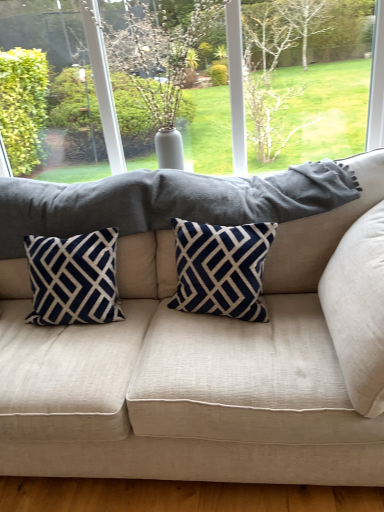
Question: Should I look upward or downward to see beige fabric pillow at right, arranged as the first pillow when viewed from the right?

Choices:
 (A) down
 (B) up

Answer: (A)

Question: Is navy velvet pillow at left, which ranks as the 3th pillow in right-to-left order, closer to camera compared to beige fabric pillow at right, arranged as the first pillow when viewed from the right?

Choices:
 (A) yes
 (B) no

Answer: (B)

Question: From a real-world perspective, is navy velvet pillow at left, arranged as the 1th pillow when viewed from the left, beneath beige fabric pillow at right, arranged as the first pillow when viewed from the right?

Choices:
 (A) yes
 (B) no

Answer: (A)

Question: Is navy velvet pillow at left, which ranks as the 3th pillow in right-to-left order, taller than beige fabric pillow at right, which ranks as the 3th pillow in left-to-right order?

Choices:
 (A) no
 (B) yes

Answer: (A)

Question: Is navy velvet pillow at left, arranged as the 1th pillow when viewed from the left, aimed at beige fabric pillow at right, arranged as the first pillow when viewed from the right?

Choices:
 (A) no
 (B) yes

Answer: (A)

Question: From the image's perspective, is navy velvet pillow at left, arranged as the 1th pillow when viewed from the left, above beige fabric pillow at right, arranged as the first pillow when viewed from the right?

Choices:
 (A) yes
 (B) no

Answer: (A)

Question: Considering the relative sizes of navy velvet pillow at left, which ranks as the 3th pillow in right-to-left order, and beige fabric pillow at right, which ranks as the 3th pillow in left-to-right order, in the image provided, is navy velvet pillow at left, which ranks as the 3th pillow in right-to-left order, thinner than beige fabric pillow at right, which ranks as the 3th pillow in left-to-right order,?

Choices:
 (A) no
 (B) yes

Answer: (B)

Question: Can you confirm if green leafy tree at upper center is bigger than beige fabric pillow at right, arranged as the first pillow when viewed from the right?

Choices:
 (A) yes
 (B) no

Answer: (B)

Question: Is green leafy tree at upper center at the right side of beige fabric pillow at right, which ranks as the 3th pillow in left-to-right order?

Choices:
 (A) no
 (B) yes

Answer: (A)

Question: Is green leafy tree at upper center touching beige fabric pillow at right, arranged as the first pillow when viewed from the right?

Choices:
 (A) no
 (B) yes

Answer: (A)

Question: From a real-world perspective, is green leafy tree at upper center located higher than beige fabric pillow at right, arranged as the first pillow when viewed from the right?

Choices:
 (A) no
 (B) yes

Answer: (B)

Question: Is green leafy tree at upper center closer to camera compared to beige fabric pillow at right, arranged as the first pillow when viewed from the right?

Choices:
 (A) no
 (B) yes

Answer: (A)

Question: Are green leafy tree at upper center and beige fabric pillow at right, which ranks as the 3th pillow in left-to-right order, far apart?

Choices:
 (A) no
 (B) yes

Answer: (B)

Question: Considering the relative positions of beige fabric couch at center and green leafy tree at upper center in the image provided, is beige fabric couch at center behind green leafy tree at upper center?

Choices:
 (A) yes
 (B) no

Answer: (B)